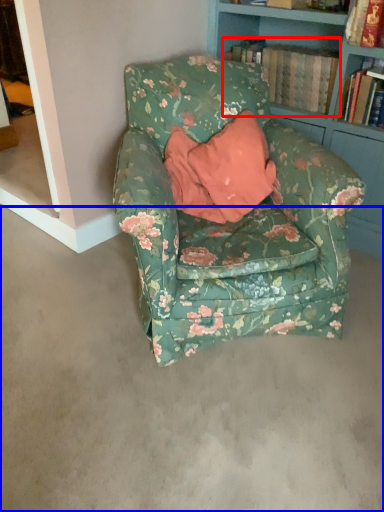
Question: Which point is further to the camera, book (highlighted by a red box) or concrete (highlighted by a blue box)?

Choices:
 (A) book
 (B) concrete

Answer: (A)